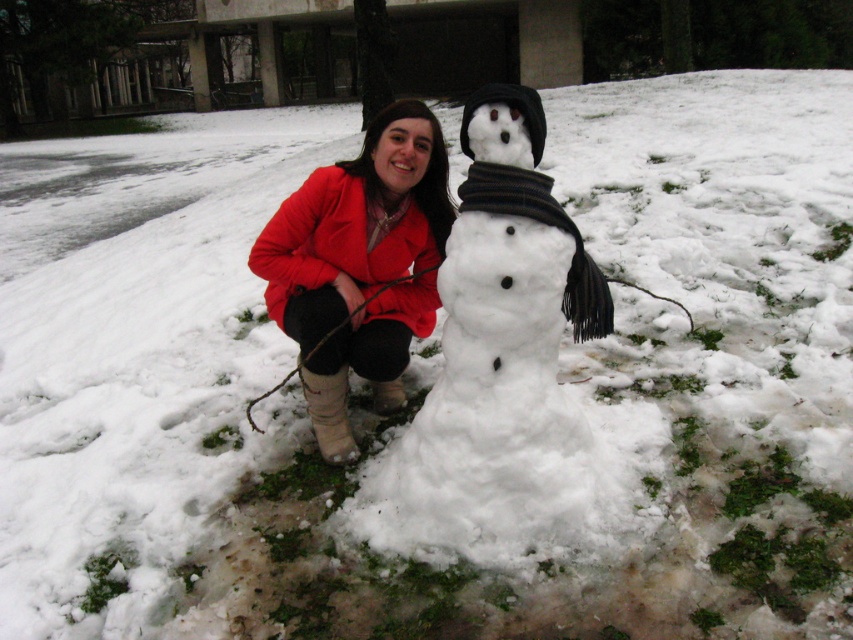
Question: Observing the image, what is the correct spatial positioning of white fluffy snowman at center in reference to matte red coat at center?

Choices:
 (A) left
 (B) right

Answer: (B)

Question: Observing the image, what is the correct spatial positioning of white fluffy snowman at center in reference to red matte jacket at center?

Choices:
 (A) above
 (B) below

Answer: (B)

Question: Which object appears closest to the camera in this image?

Choices:
 (A) white fluffy snowman at center
 (B) red matte jacket at center
 (C) matte red coat at center

Answer: (A)

Question: Which of the following is the farthest from the observer?

Choices:
 (A) (352, 346)
 (B) (303, 225)
 (C) (508, 106)

Answer: (B)

Question: Can you confirm if matte red coat at center is positioned below red matte jacket at center?

Choices:
 (A) no
 (B) yes

Answer: (B)

Question: Which point is closer to the camera?

Choices:
 (A) (357, 182)
 (B) (276, 241)

Answer: (B)